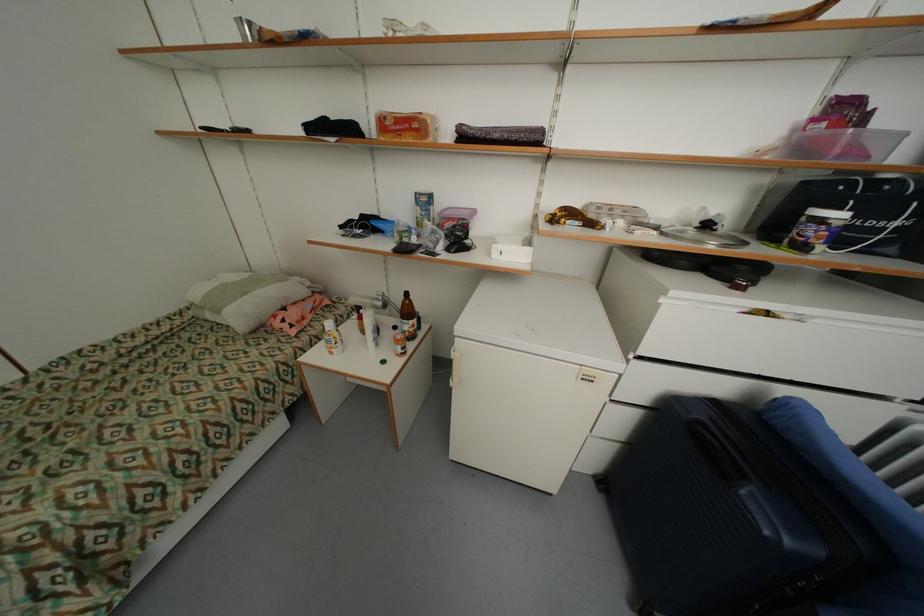
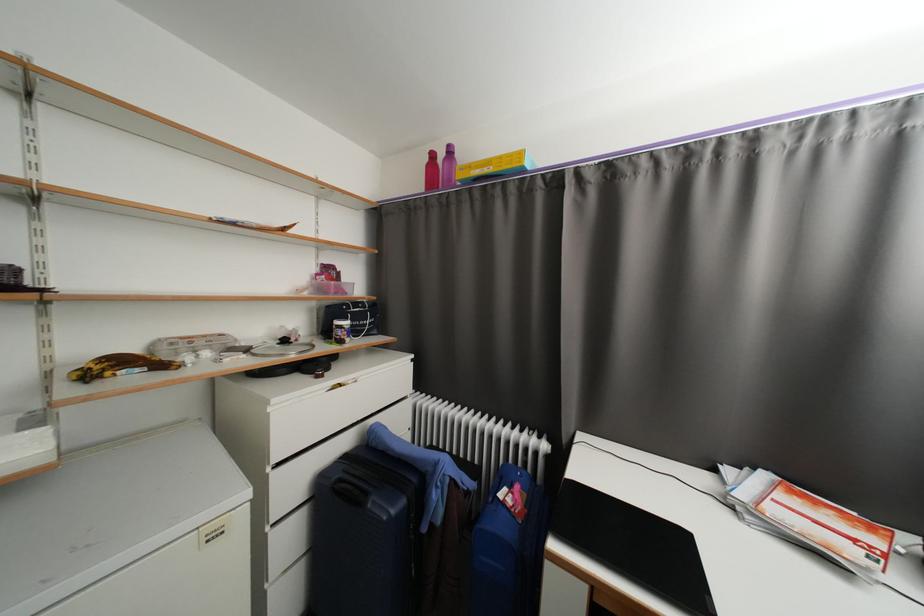
In the second image, find the point that corresponds to the point at 598,225 in the first image.

(167, 367)